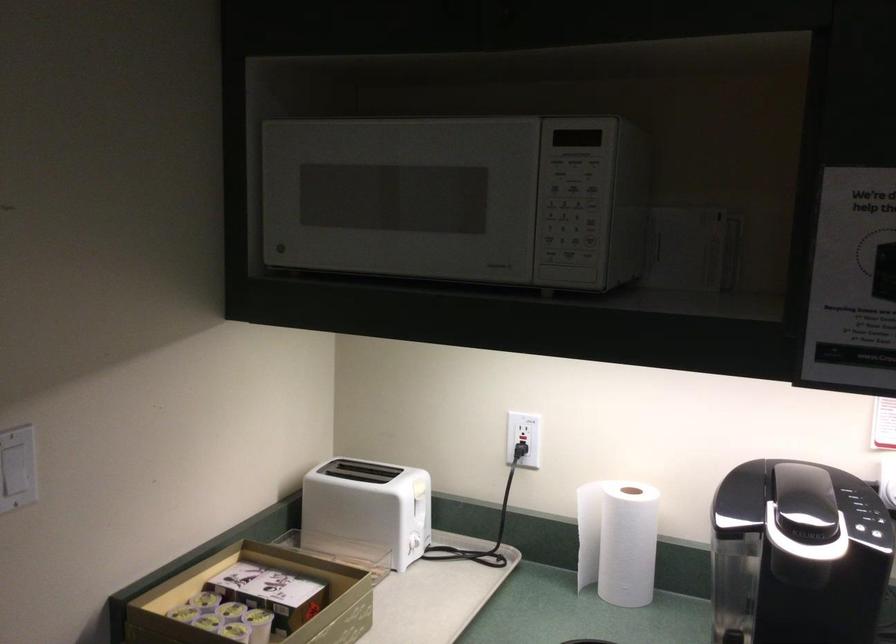
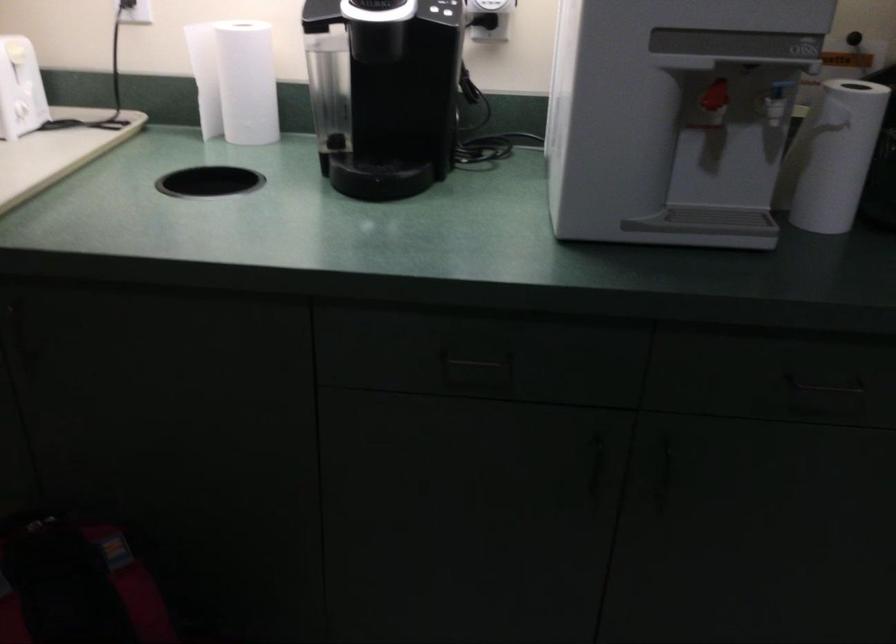
First-person continuous shooting, in which direction is the camera rotating?

The camera rotated toward right-down.